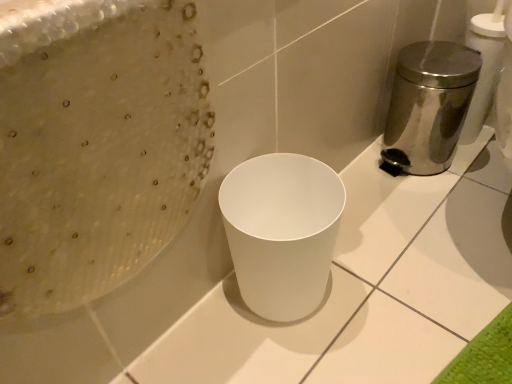
Where is `free space that is in between white matte waste container at center and polished stainless steel trash can at right`? free space that is in between white matte waste container at center and polished stainless steel trash can at right is located at coordinates (372, 217).